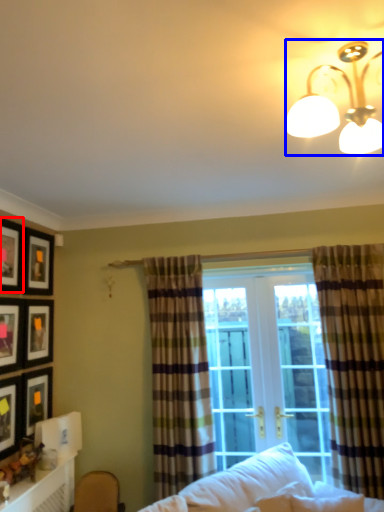
Question: Which point is further to the camera, picture frame (highlighted by a red box) or lamp (highlighted by a blue box)?

Choices:
 (A) picture frame
 (B) lamp

Answer: (A)